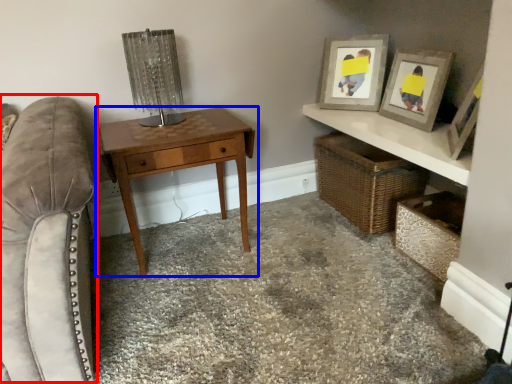
Question: Which point is closer to the camera, swivel chair (highlighted by a red box) or table (highlighted by a blue box)?

Choices:
 (A) swivel chair
 (B) table

Answer: (A)